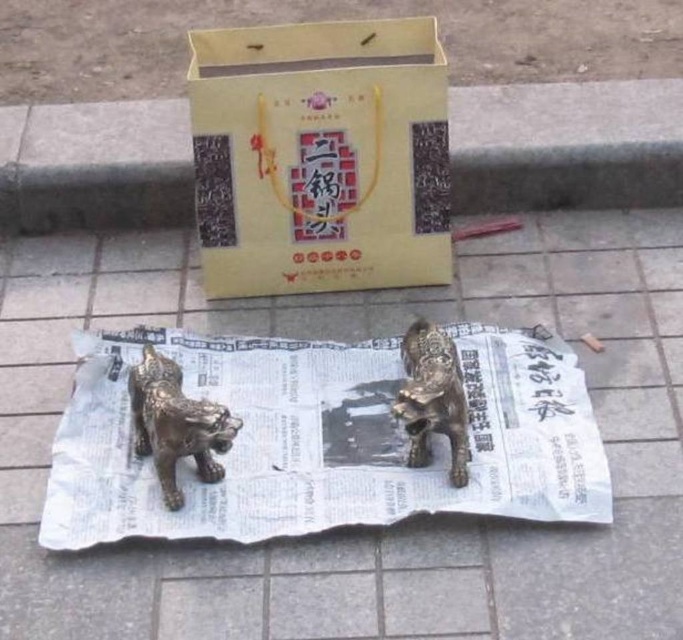
You are a delivery person who just arrived at a location. You see a matte cardboard box at upper center and a matte gold paper bag at upper center. Which one is positioned more to the left side?

The matte cardboard box at upper center is positioned more to the left side because it is to the left of the matte gold paper bag at upper center.

You are a delivery person who needs to place a 20 inch long package between the matte cardboard box at upper center and the gold metallic lion at center. Is there enough space to fit the package without moving either object?

The matte cardboard box at upper center is 19.76 inches from the gold metallic lion at center, so there is not enough space to fit a 20 inch long package between them without moving either object.

You are organizing items on a table and need to place a matte cardboard box at upper center and a matte gold paper bag at upper center. Since the table has limited space, which item should you prioritize keeping if you can only keep one due to size?

The matte cardboard box at upper center is bigger than the matte gold paper bag at upper center, so you should prioritize keeping the matte gold paper bag at upper center to save space.